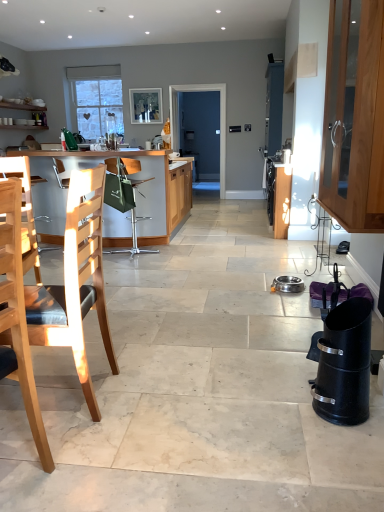
Where is `free spot to the left of black matte trash can at lower right, which is the first appliance from front to back`? This screenshot has width=384, height=512. free spot to the left of black matte trash can at lower right, which is the first appliance from front to back is located at coordinates (289, 411).